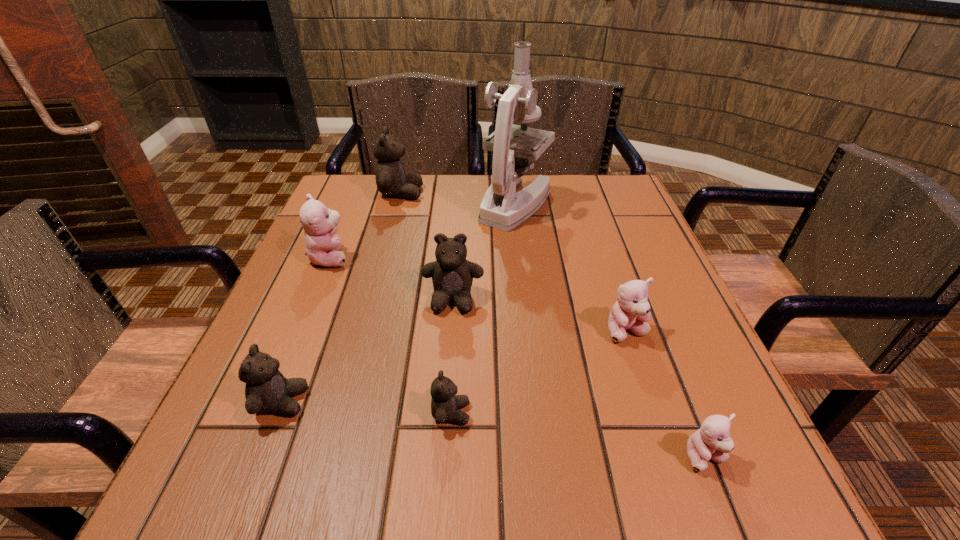
Image resolution: width=960 pixels, height=540 pixels. Identify the location of vacant space located on the face of the smallest brown teddy bear. (583, 413).

At what (x,y) coordinates should I click in order to perform the action: click on free location located at the face of the nearest pink teddy bear. Please return your answer as a coordinate pair (x, y). Looking at the image, I should click on (727, 512).

This screenshot has height=540, width=960. I want to click on microscope that is positioned at the far edge, so click(x=501, y=207).

Image resolution: width=960 pixels, height=540 pixels. I want to click on teddy bear that is at the far edge, so click(391, 180).

Where is `object at the near edge`? Image resolution: width=960 pixels, height=540 pixels. object at the near edge is located at coordinates (x=712, y=441).

You are a GUI agent. You are given a task and a screenshot of the screen. Output one action in this format:
    pyautogui.click(x=<x>, y=<y>)
    Task: Click on the object present at the far left corner
    The width and height of the screenshot is (960, 540).
    Given the screenshot: What is the action you would take?
    pyautogui.click(x=391, y=180)

Identify the location of object situated at the near right corner. Image resolution: width=960 pixels, height=540 pixels. (712, 441).

Identify the location of free region at the far edge. (397, 203).

Find the location of a particular element. This screenshot has width=960, height=540. vacant region at the left edge is located at coordinates (341, 286).

Locate an element on the screen. The image size is (960, 540). free point at the right edge is located at coordinates click(673, 422).